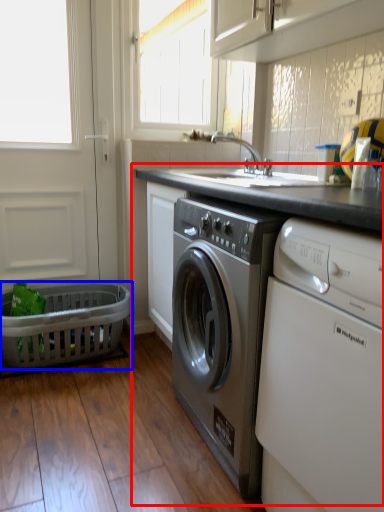
Question: Which point is further to the camera, counter (highlighted by a red box) or basket (highlighted by a blue box)?

Choices:
 (A) counter
 (B) basket

Answer: (B)